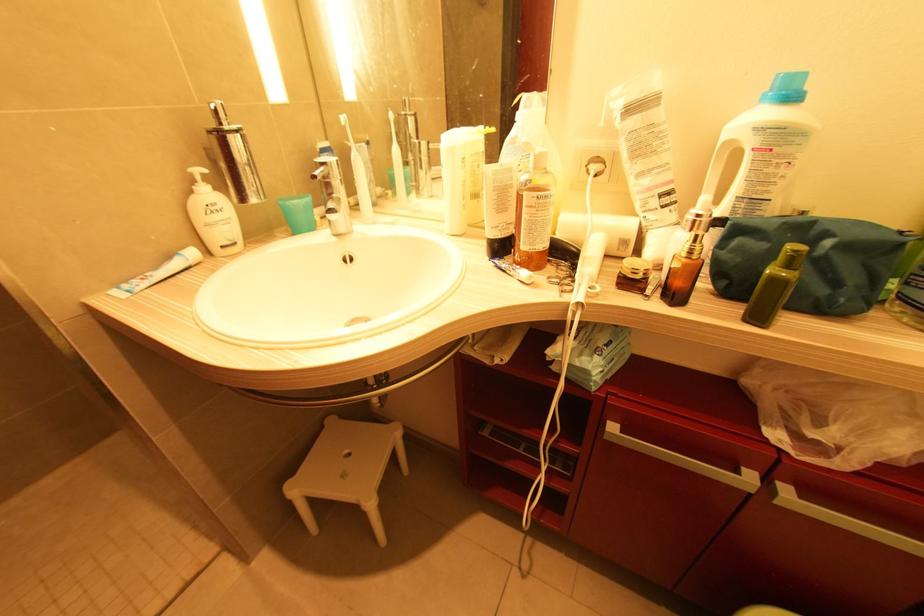
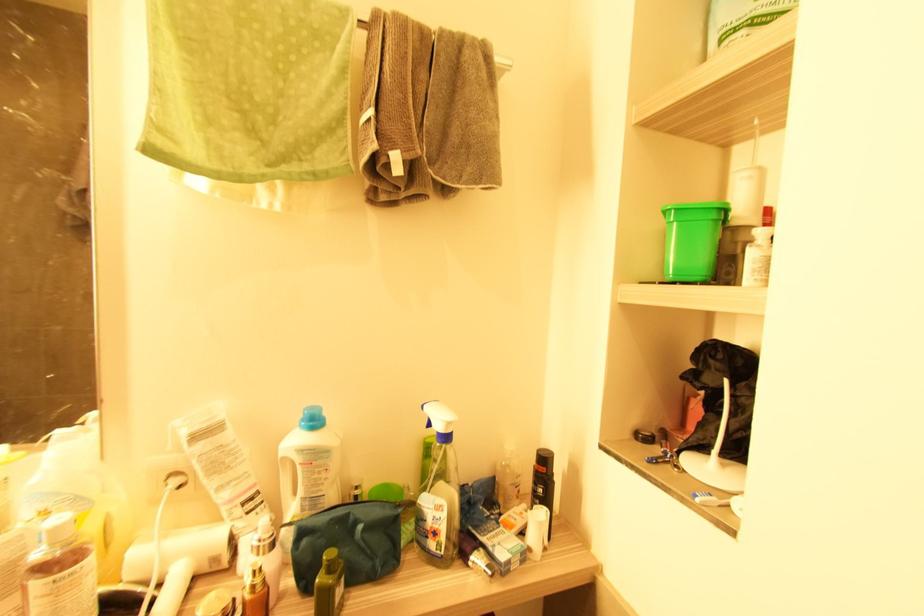
Question: I am providing you with two images of the same scene from different viewpoints. After the viewpoint changes to image2, which objects are now occluded?

Choices:
 (A) green toiletry bag
 (B) black spray bottle
 (C) bottle with red cap
 (D) none of these

Answer: (D)